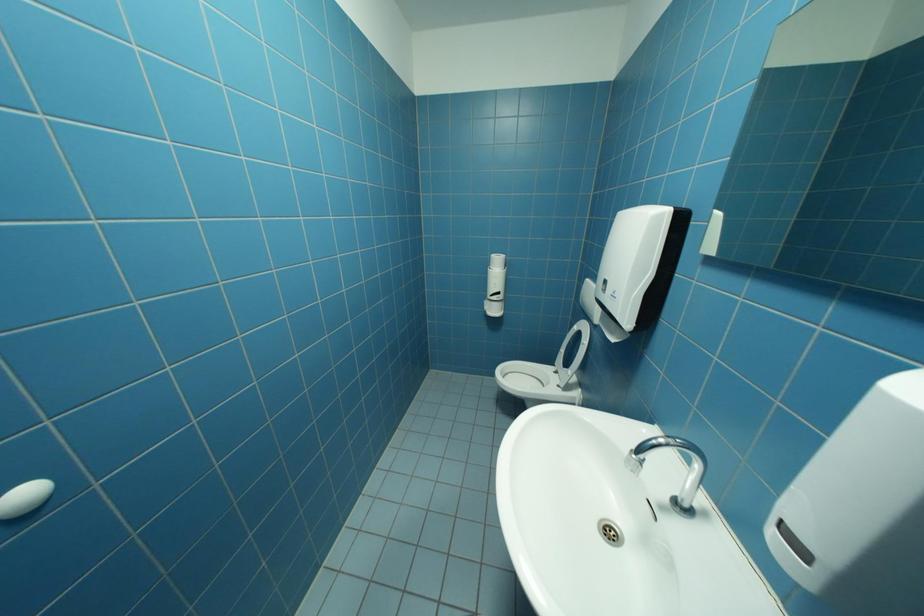
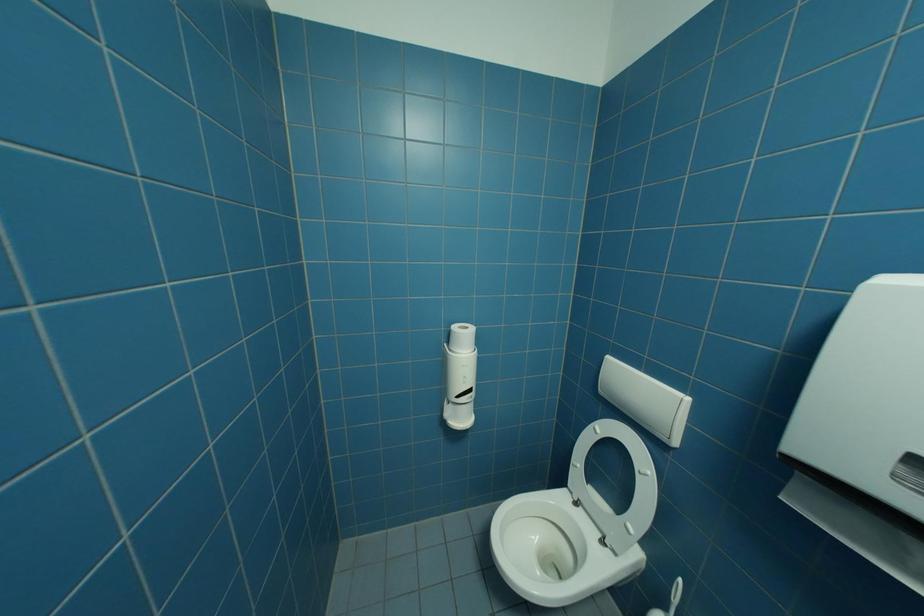
Question: The camera is either moving clockwise (left) or counter-clockwise (right) around the object. The first image is from the beginning of the video and the second image is from the end. Is the camera moving left or right when shooting the video?

Choices:
 (A) Left
 (B) Right

Answer: (A)